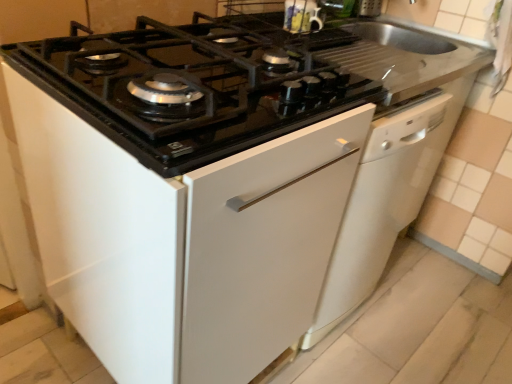
Question: From a real-world perspective, is black glass gas stove at upper center under white glossy dishwasher at center?

Choices:
 (A) yes
 (B) no

Answer: (B)

Question: Can you confirm if black glass gas stove at upper center is bigger than white glossy dishwasher at center?

Choices:
 (A) no
 (B) yes

Answer: (A)

Question: Are black glass gas stove at upper center and white glossy dishwasher at center making contact?

Choices:
 (A) yes
 (B) no

Answer: (B)

Question: Is black glass gas stove at upper center looking in the opposite direction of white glossy dishwasher at center?

Choices:
 (A) no
 (B) yes

Answer: (A)

Question: Is the depth of black glass gas stove at upper center greater than that of white glossy dishwasher at center?

Choices:
 (A) yes
 (B) no

Answer: (B)

Question: Is black glass gas stove at upper center shorter than white glossy dishwasher at center?

Choices:
 (A) no
 (B) yes

Answer: (B)

Question: Is white glossy dishwasher at center in front of black glass gas stove at upper center?

Choices:
 (A) yes
 (B) no

Answer: (B)

Question: Is white glossy dishwasher at center turned away from black glass gas stove at upper center?

Choices:
 (A) yes
 (B) no

Answer: (B)

Question: From a real-world perspective, is white glossy dishwasher at center physically above black glass gas stove at upper center?

Choices:
 (A) yes
 (B) no

Answer: (B)

Question: Considering the relative positions of white glossy dishwasher at center and black glass gas stove at upper center in the image provided, is white glossy dishwasher at center behind black glass gas stove at upper center?

Choices:
 (A) no
 (B) yes

Answer: (B)

Question: From a real-world perspective, is white glossy dishwasher at center located beneath black glass gas stove at upper center?

Choices:
 (A) yes
 (B) no

Answer: (A)

Question: Is white glossy dishwasher at center wider than black glass gas stove at upper center?

Choices:
 (A) no
 (B) yes

Answer: (A)

Question: In the image, is white glossy dishwasher at center positioned in front of or behind black glass gas stove at upper center?

Choices:
 (A) front
 (B) behind

Answer: (B)